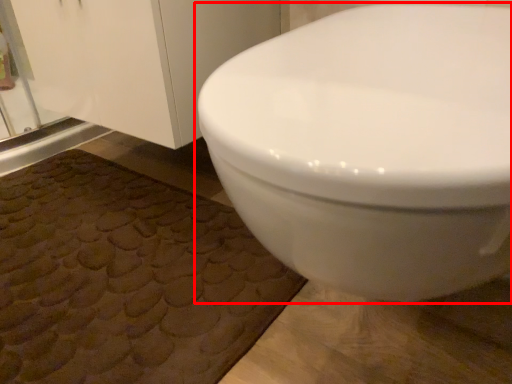
Question: In this image, where is toilet (annotated by the red box) located relative to bath mat?

Choices:
 (A) right
 (B) left

Answer: (A)